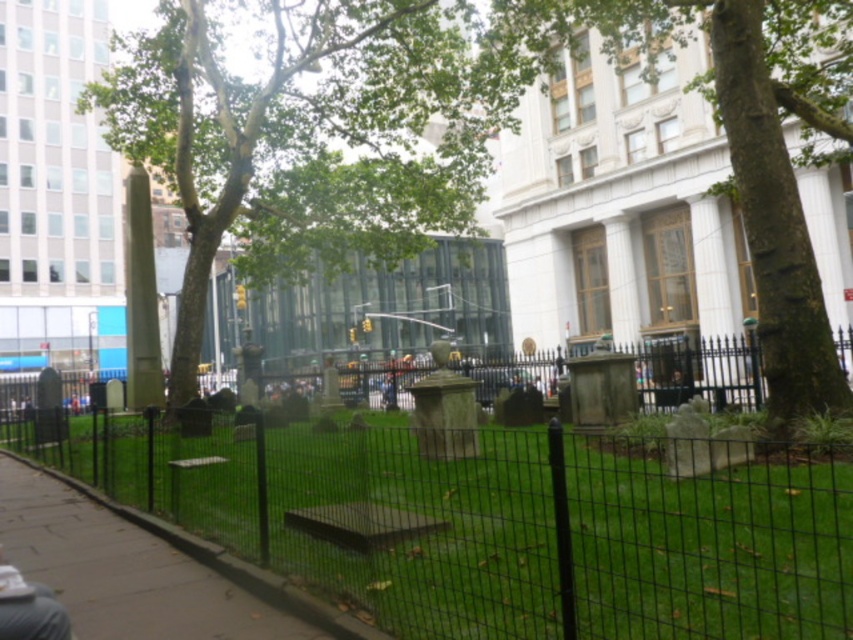
You are a gardener planning to mow the green grass at center and trim the green textured bark at center. Which area will require a wider mower or trimmer attachment?

The green textured bark at center requires a wider attachment because its width is greater than the green grass at center.

You are a gardener who needs to mow the lawn. You see the green grass at center and the smooth concrete pavement at lower left. Which area requires mowing?

The green grass at center requires mowing because it is much taller than the smooth concrete pavement at lower left, which is likely already maintained.